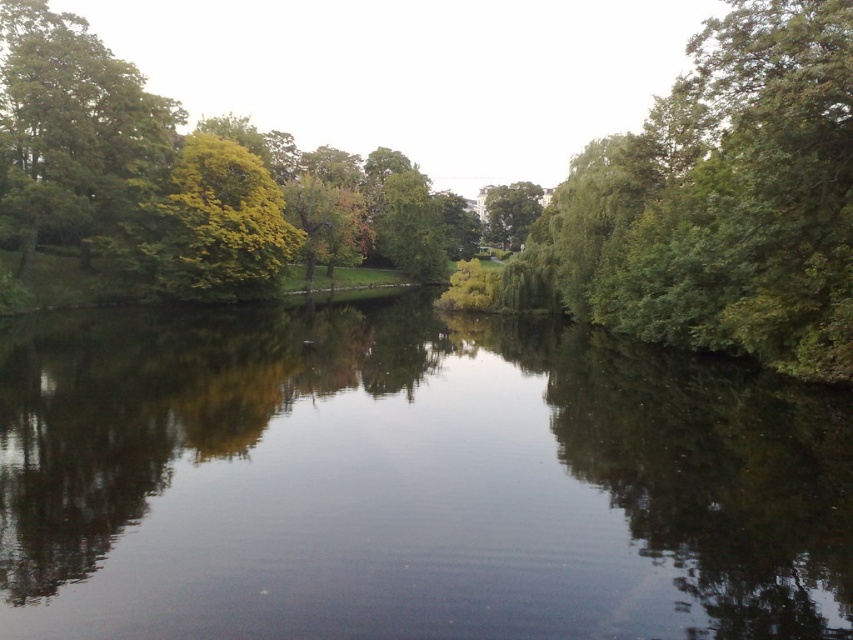
Question: Which object is closer to the camera taking this photo?

Choices:
 (A) green leafy tree at upper left
 (B) green leafy tree at right

Answer: (B)

Question: Among these points, which one is nearest to the camera?

Choices:
 (A) (461, 538)
 (B) (662, 312)

Answer: (A)

Question: Is green leafy tree at center below green leafy tree at upper left?

Choices:
 (A) yes
 (B) no

Answer: (B)

Question: Estimate the real-world distances between objects in this image. Which object is closer to the smooth reflective water at center?

Choices:
 (A) green leafy tree at right
 (B) green leafy tree at upper left
 (C) green leafy tree at center
 (D) yellow-green foliage at upper left

Answer: (A)

Question: Does green leafy tree at center have a lesser width compared to green leafy tree at right?

Choices:
 (A) yes
 (B) no

Answer: (B)

Question: Can you confirm if green leafy tree at center is positioned above green leafy tree at upper left?

Choices:
 (A) yes
 (B) no

Answer: (A)